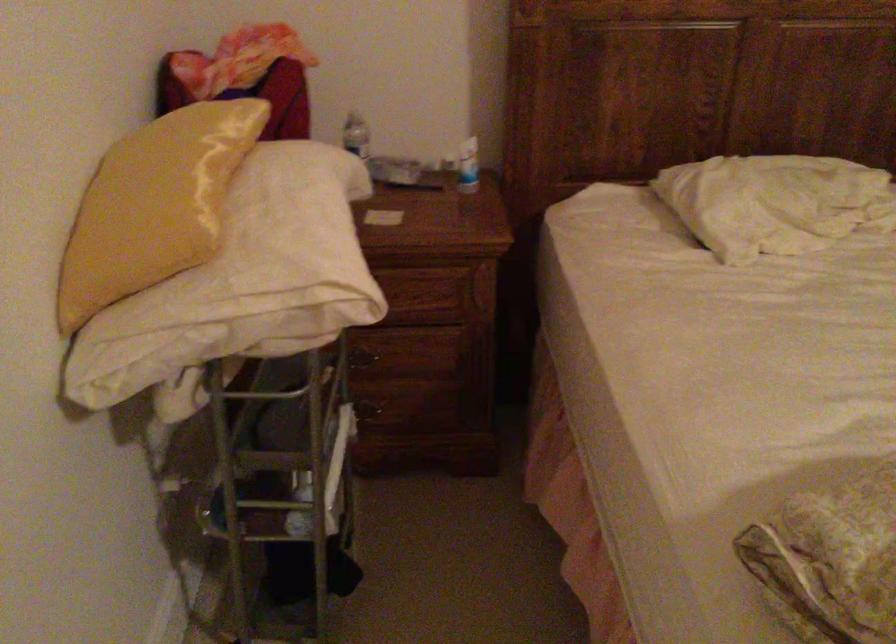
Image resolution: width=896 pixels, height=644 pixels. What do you see at coordinates (412, 365) in the screenshot? I see `the drawer handle` at bounding box center [412, 365].